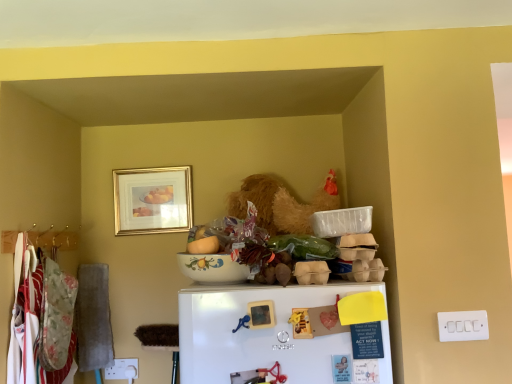
Question: From the image's perspective, is porcelain floral bowl at center located above or below floral fabric laundry at left?

Choices:
 (A) above
 (B) below

Answer: (A)

Question: Relative to floral fabric laundry at left, is porcelain floral bowl at center in front or behind?

Choices:
 (A) front
 (B) behind

Answer: (A)

Question: Considering the real-world distances, which object is closest to the matte ceramic bowl at center?

Choices:
 (A) floral fabric laundry at left
 (B) metallic hanger at left
 (C) gold/glass picture frame at upper center
 (D) white plastic switch at lower right
 (E) porcelain floral bowl at center

Answer: (E)

Question: Based on their relative distances, which object is nearer to the gold/glass picture frame at upper center?

Choices:
 (A) floral fabric laundry at left
 (B) white matte refrigerator at lower center
 (C) matte ceramic bowl at center
 (D) porcelain floral bowl at center
 (E) white plastic switch at lower right

Answer: (A)